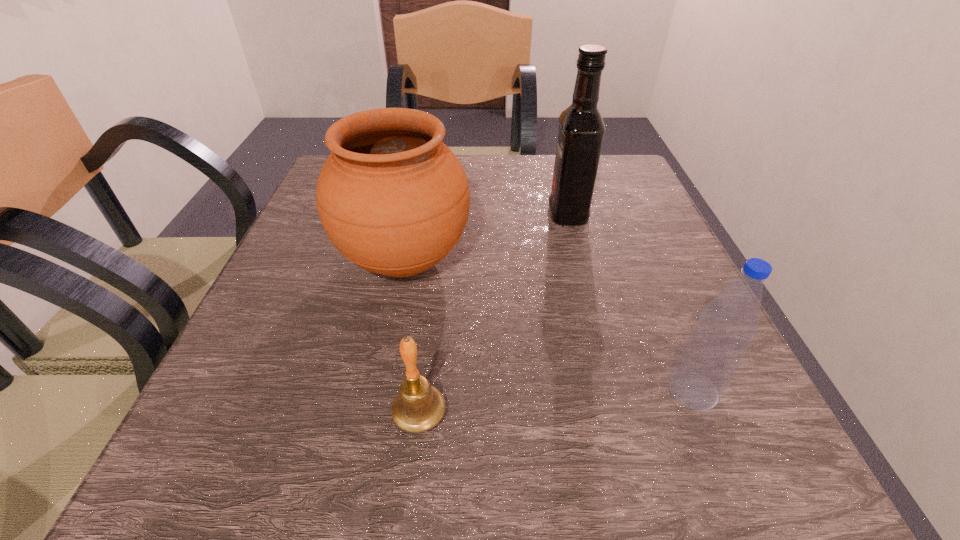
This screenshot has height=540, width=960. I want to click on vacant space situated on the front of the bell, so click(413, 479).

The width and height of the screenshot is (960, 540). In order to click on object at the far edge in this screenshot , I will do `click(581, 127)`.

Image resolution: width=960 pixels, height=540 pixels. I want to click on object that is positioned at the near edge, so click(x=418, y=407).

The height and width of the screenshot is (540, 960). What are the coordinates of `object located in the left edge section of the desktop` in the screenshot? It's located at (392, 197).

Locate an element on the screen. The height and width of the screenshot is (540, 960). liquor that is at the right edge is located at coordinates (581, 127).

Where is `water bottle that is at the right edge`? This screenshot has height=540, width=960. water bottle that is at the right edge is located at coordinates (713, 352).

At what (x,y) coordinates should I click in order to perform the action: click on object situated at the far right corner. Please return your answer as a coordinate pair (x, y). The height and width of the screenshot is (540, 960). Looking at the image, I should click on (581, 127).

In the image, there is a desktop. In order to click on vacant space at the far edge in this screenshot , I will do `click(507, 180)`.

Where is `blank space at the near edge of the desktop`? The height and width of the screenshot is (540, 960). blank space at the near edge of the desktop is located at coordinates (330, 438).

Locate an element on the screen. Image resolution: width=960 pixels, height=540 pixels. vacant space at the left edge of the desktop is located at coordinates (239, 418).